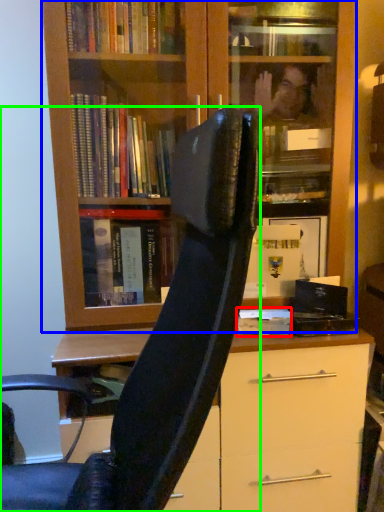
Question: Based on their relative distances, which object is nearer to paperback book (highlighted by a red box)? Choose from bookcase (highlighted by a blue box) and chair (highlighted by a green box).

Choices:
 (A) bookcase
 (B) chair

Answer: (B)